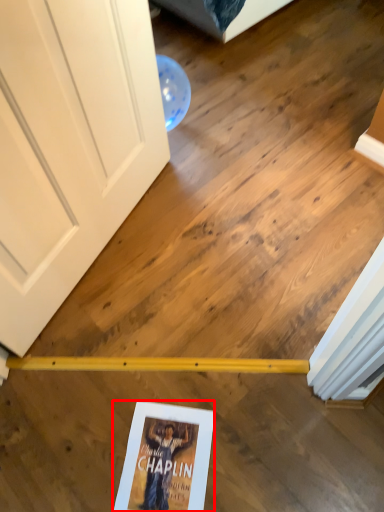
Question: From the image's perspective, what is the correct spatial relationship of paperback book (annotated by the red box) in relation to door?

Choices:
 (A) above
 (B) below

Answer: (B)